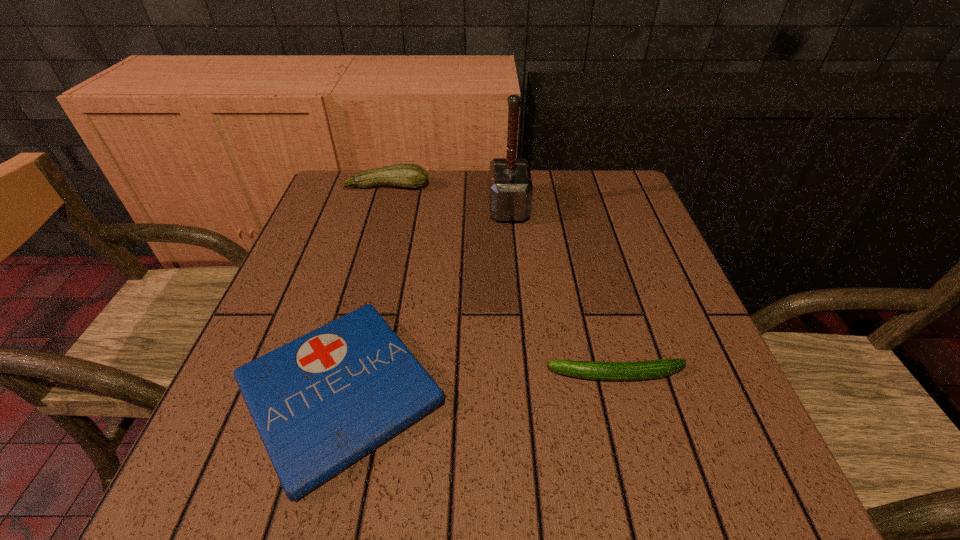
I want to click on hammer, so click(510, 185).

This screenshot has height=540, width=960. What are the coordinates of `the left zucchini` in the screenshot? It's located at (413, 176).

Locate an element on the screen. The image size is (960, 540). the farther zucchini is located at coordinates [x=413, y=176].

Where is `the shorter zucchini`? This screenshot has width=960, height=540. the shorter zucchini is located at coordinates (642, 370).

Locate an element on the screen. the right zucchini is located at coordinates (642, 370).

Find the location of a particular element. the first-aid kit is located at coordinates (320, 403).

Locate an element on the screen. The image size is (960, 540). vacant region located on the left of the hammer is located at coordinates (350, 207).

The height and width of the screenshot is (540, 960). I want to click on vacant space located at the stem end of the third shortest object, so click(370, 246).

I want to click on free region located 0.080m on the front-facing side of the right zucchini, so click(x=499, y=375).

At what (x,y) coordinates should I click in order to perform the action: click on free space located 0.120m on the front-facing side of the right zucchini. Please return your answer as a coordinate pair (x, y). This screenshot has width=960, height=540. Looking at the image, I should click on (476, 375).